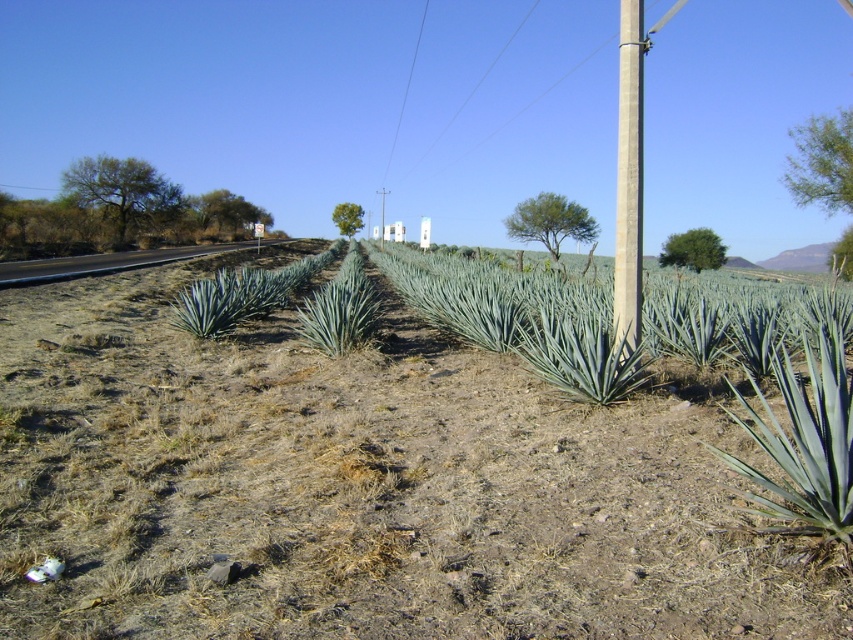
Consider the image. Is green leafy grass at center closer to camera compared to gray concrete pole at right?

That is True.

Is green leafy grass at center smaller than gray concrete pole at right?

Indeed, green leafy grass at center has a smaller size compared to gray concrete pole at right.

Which is behind, point (132, 636) or point (639, 172)?

Point (639, 172)

This screenshot has width=853, height=640. What are the coordinates of `green leafy grass at center` in the screenshot? It's located at (357, 486).